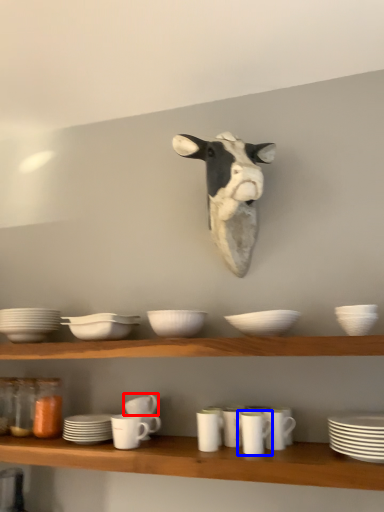
Question: Which object is further to the camera taking this photo, tableware (highlighted by a red box) or tableware (highlighted by a blue box)?

Choices:
 (A) tableware
 (B) tableware

Answer: (A)